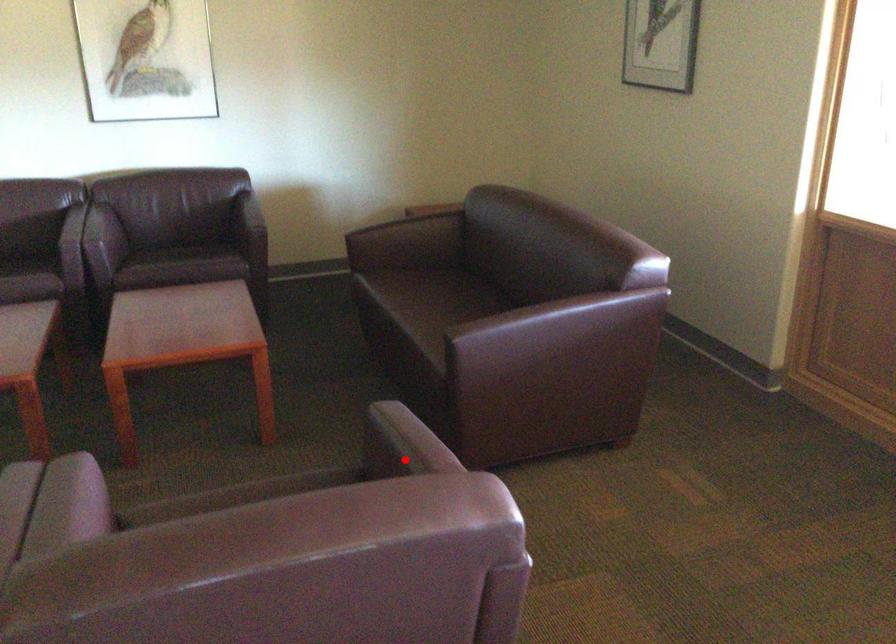
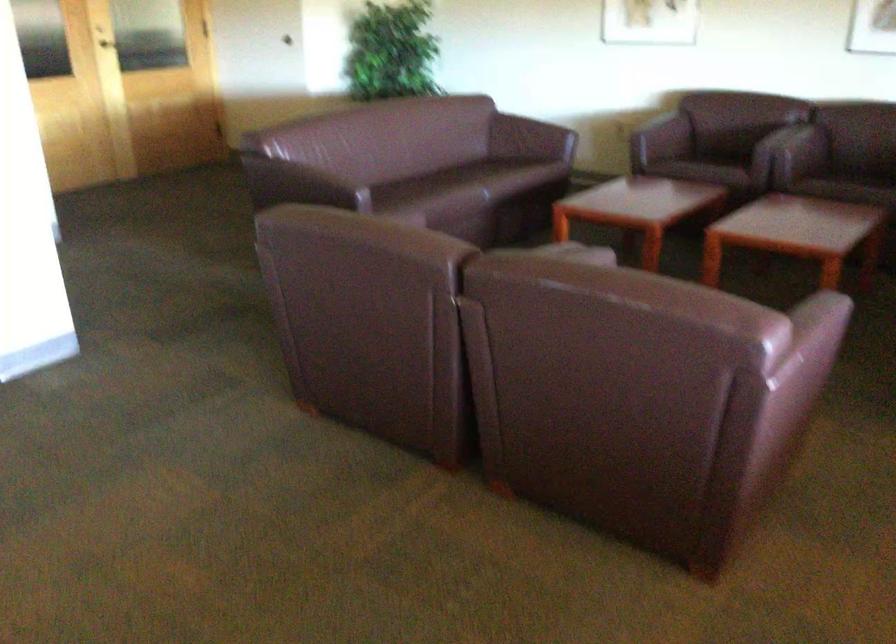
Find the pixel in the second image that matches the highlighted location in the first image.

(821, 325)